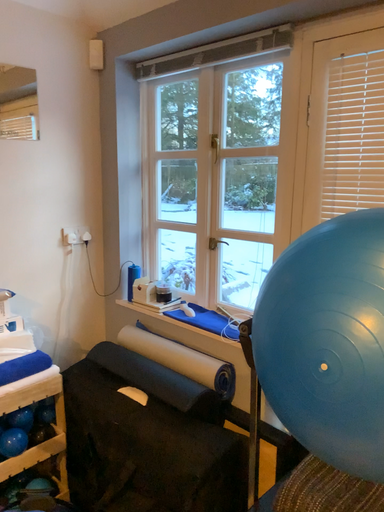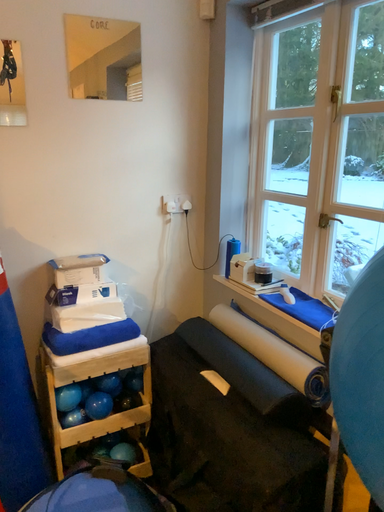
Question: Which way did the camera rotate in the video?

Choices:
 (A) rotated left
 (B) rotated right

Answer: (A)